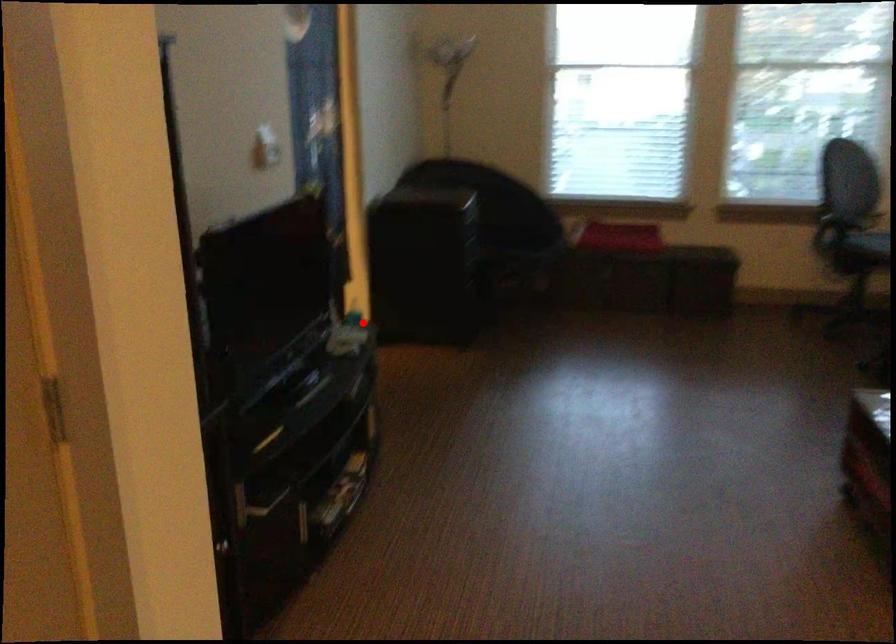
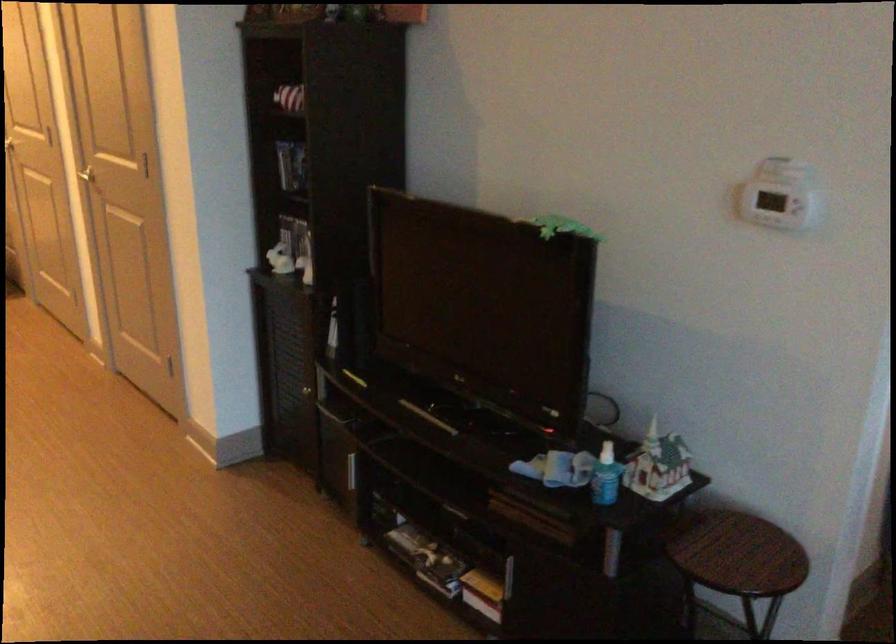
Question: I am providing you with two images of the same scene from different viewpoints. In image1, a red point is highlighted. Considering the same 3D point in image2, which of the following is correct?

Choices:
 (A) It is closer
 (B) It is farther

Answer: (A)